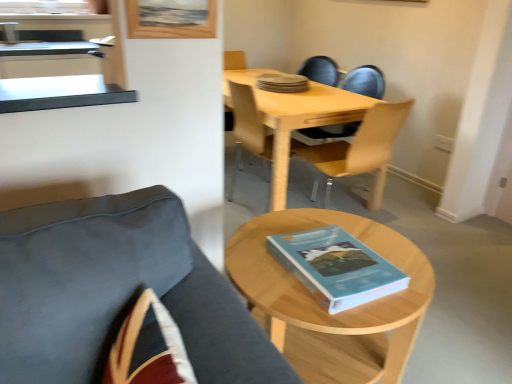
Find the location of a particular element. This screenshot has width=512, height=384. free space to the left of blue matte book at center, which ranks as the second book in top-to-bottom order is located at coordinates (256, 270).